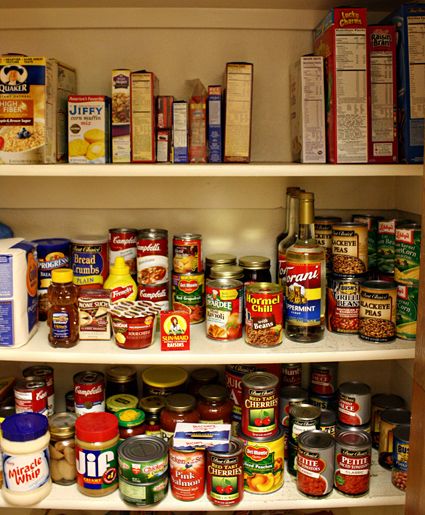
Where is `4 boxes of cereal`? This screenshot has height=515, width=425. 4 boxes of cereal is located at coordinates (417, 97), (387, 98), (348, 105), (317, 110).